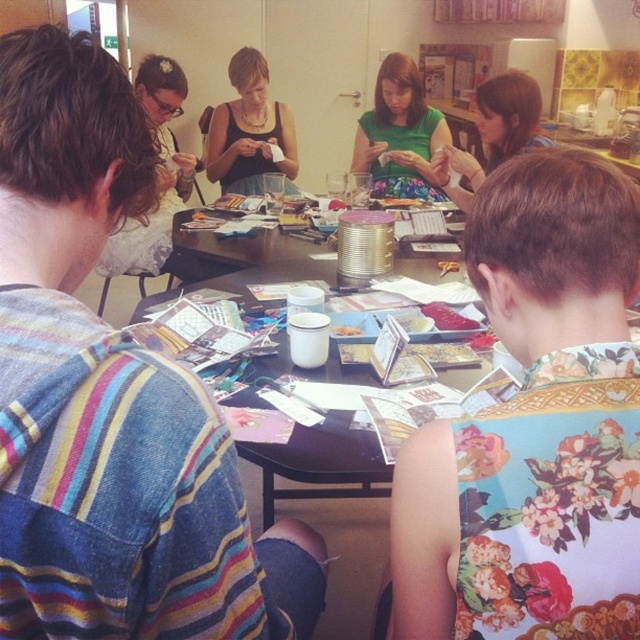
Question: Is floral fabric shirt at lower right smaller than green fabric dress at upper center?

Choices:
 (A) yes
 (B) no

Answer: (A)

Question: Which object appears closest to the camera in this image?

Choices:
 (A) matte black tank top at center
 (B) matte white blouse at upper left
 (C) green fabric dress at center

Answer: (B)

Question: Which object is the farthest from the floral fabric shirt at lower right?

Choices:
 (A) white matte cup at center
 (B) matte white blouse at upper left

Answer: (B)

Question: Observing the image, what is the correct spatial positioning of matte black tank top at center in reference to green fabric dress at upper center?

Choices:
 (A) left
 (B) right

Answer: (A)

Question: Considering the real-world distances, which object is closest to the matte black tank top at center?

Choices:
 (A) white matte cup at center
 (B) matte white blouse at upper left
 (C) green fabric dress at center
 (D) green fabric dress at upper center

Answer: (B)

Question: Where is green fabric dress at center located in relation to matte black tank top at center in the image?

Choices:
 (A) left
 (B) right

Answer: (B)